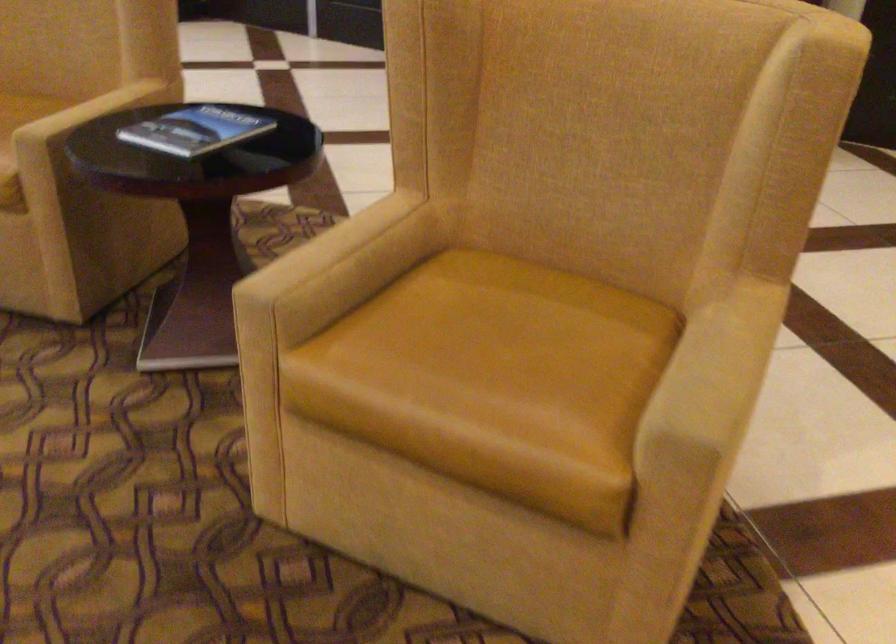
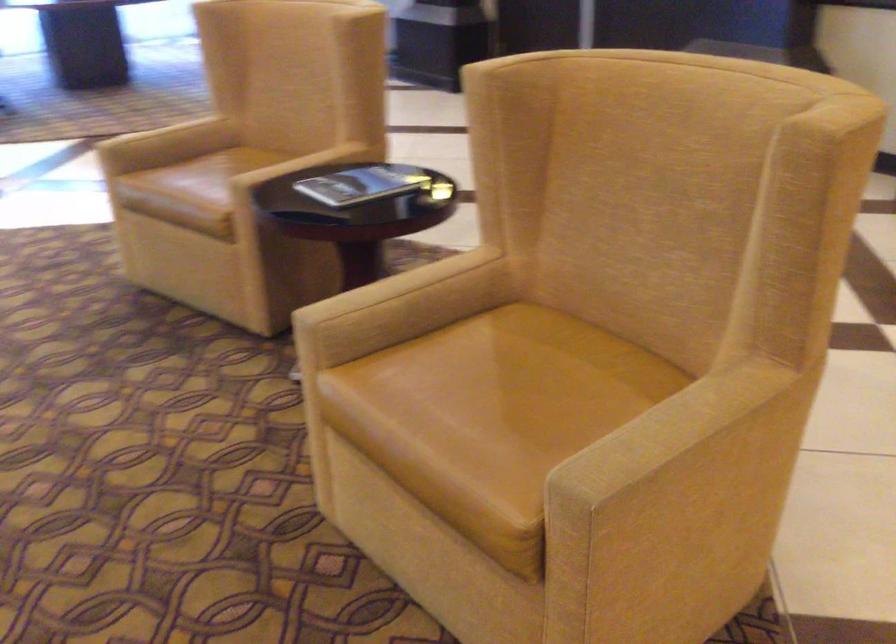
In the second image, find the point that corresponds to the point at 325,243 in the first image.

(394, 286)